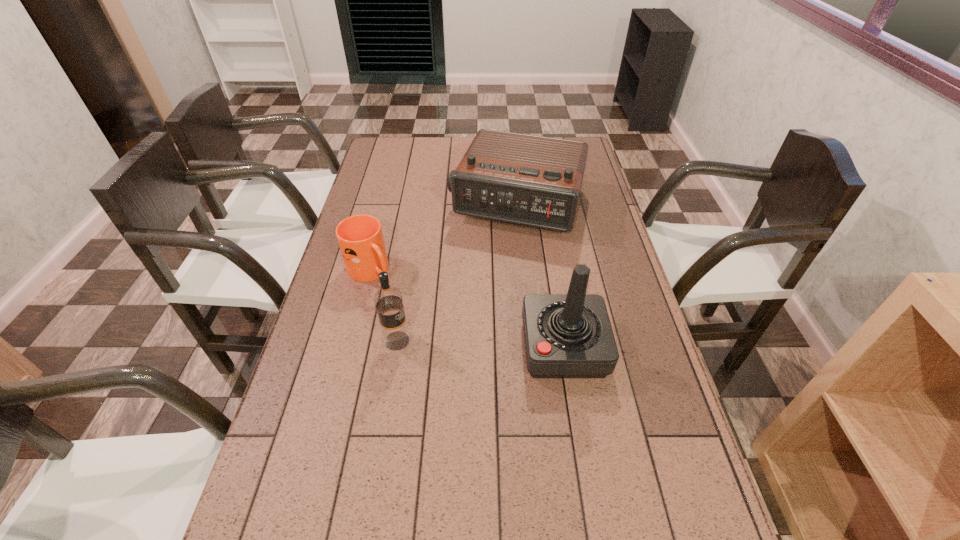
The height and width of the screenshot is (540, 960). What are the coordinates of `vacant spot on the desktop that is between the vodka and the joystick and is positioned on the handle side of the shortest object` in the screenshot? It's located at (460, 343).

Find the location of `free space on the desktop that is between the third object from right to left and the joystick and is positioned on the tuning display of the radio receiver`. free space on the desktop that is between the third object from right to left and the joystick and is positioned on the tuning display of the radio receiver is located at coordinates (467, 343).